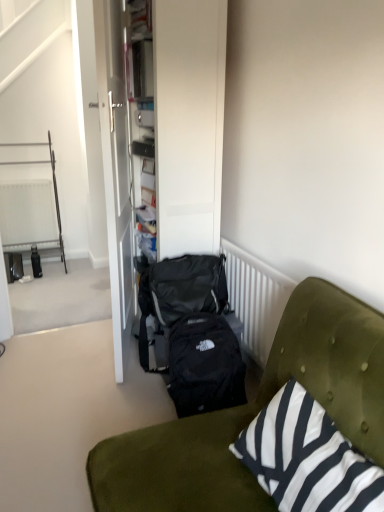
Identify the location of vacant space positioned to the left of matte black suitcase at center. The width and height of the screenshot is (384, 512). (92, 349).